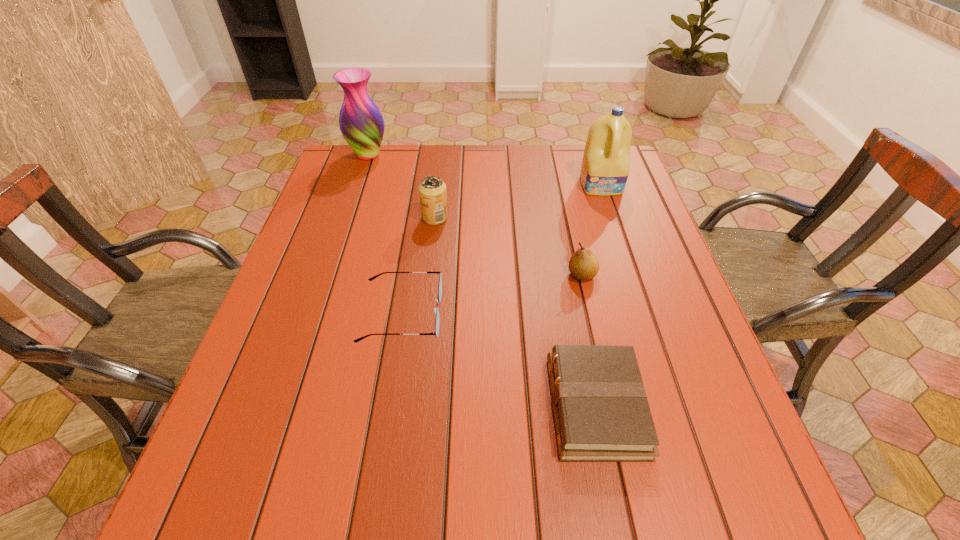
Identify the location of vacant area situated 0.270m on the label of the detergent. (628, 262).

Where is `vacant position located on the back of the fourth nearest object`? vacant position located on the back of the fourth nearest object is located at coordinates (438, 193).

Locate an element on the screen. This screenshot has height=540, width=960. free space located 0.070m on the left of the pear is located at coordinates (538, 274).

At what (x,y) coordinates should I click in order to perform the action: click on free space located on the lenses of the spectacles. Please return your answer as a coordinate pair (x, y). Looking at the image, I should click on (488, 314).

I want to click on blank area located 0.210m on the spine side of the Bible, so click(x=437, y=406).

Identify the location of vacant space located 0.150m on the spine side of the Bible. Image resolution: width=960 pixels, height=540 pixels. (469, 406).

I want to click on vacant space located 0.340m on the spine side of the Bible, so click(366, 406).

You are a GUI agent. You are given a task and a screenshot of the screen. Output one action in this format:
    pyautogui.click(x=<x>, y=<y>)
    Task: Click on the vase at the far edge
    The image size is (960, 540).
    Given the screenshot: What is the action you would take?
    pyautogui.click(x=361, y=122)

Find the location of `detergent that is at the far edge`. detergent that is at the far edge is located at coordinates pyautogui.click(x=605, y=168).

At what (x,y) coordinates should I click in order to perform the action: click on object that is at the left edge. Please return your answer as a coordinate pair (x, y). This screenshot has width=960, height=540. Looking at the image, I should click on (361, 122).